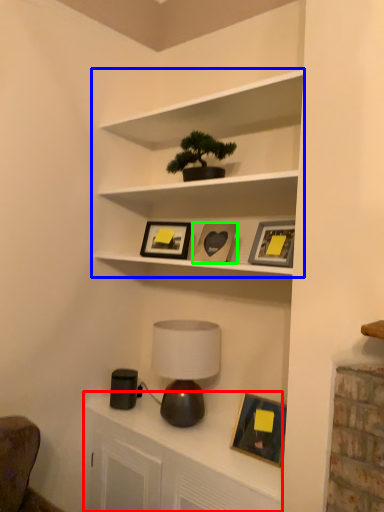
Question: Considering the real-world distances, which object is closest to dresser (highlighted by a red box)? shelf (highlighted by a blue box) or picture frame (highlighted by a green box).

Choices:
 (A) shelf
 (B) picture frame

Answer: (B)